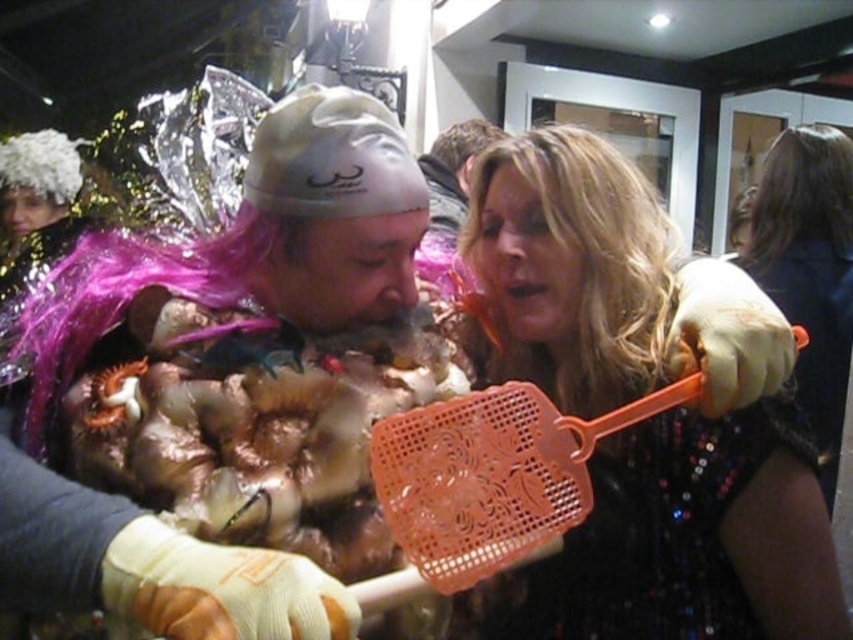
Can you confirm if frothy brown foam at center is taller than brown synthetic wig at upper right?

In fact, frothy brown foam at center may be shorter than brown synthetic wig at upper right.

Which is behind, point (285, 529) or point (786, 156)?

Point (786, 156)

At what (x,y) coordinates should I click in order to perform the action: click on frothy brown foam at center. Please return your answer as a coordinate pair (x, y). This screenshot has width=853, height=640. Looking at the image, I should click on (260, 429).

Who is positioned more to the left, shiny metallic costume at center or blonde hair at upper center?

shiny metallic costume at center is more to the left.

Is shiny metallic costume at center to the left of blonde hair at upper center from the viewer's perspective?

Correct, you'll find shiny metallic costume at center to the left of blonde hair at upper center.

Is point (157, 404) farther from viewer compared to point (590, 406)?

No, (157, 404) is in front of (590, 406).

Find the location of a particular element. shiny metallic costume at center is located at coordinates (242, 374).

Measure the distance between point [440,580] and camera.

Point [440,580] and camera are 26.31 inches apart.

Which is in front, point (395, 596) or point (810, 173)?

Positioned in front is point (395, 596).

Who is more distant from viewer, (459,509) or (782,236)?

The point (782,236) is more distant.

Where is `orange plastic fly swatter at upper right`? Image resolution: width=853 pixels, height=640 pixels. orange plastic fly swatter at upper right is located at coordinates (490, 477).